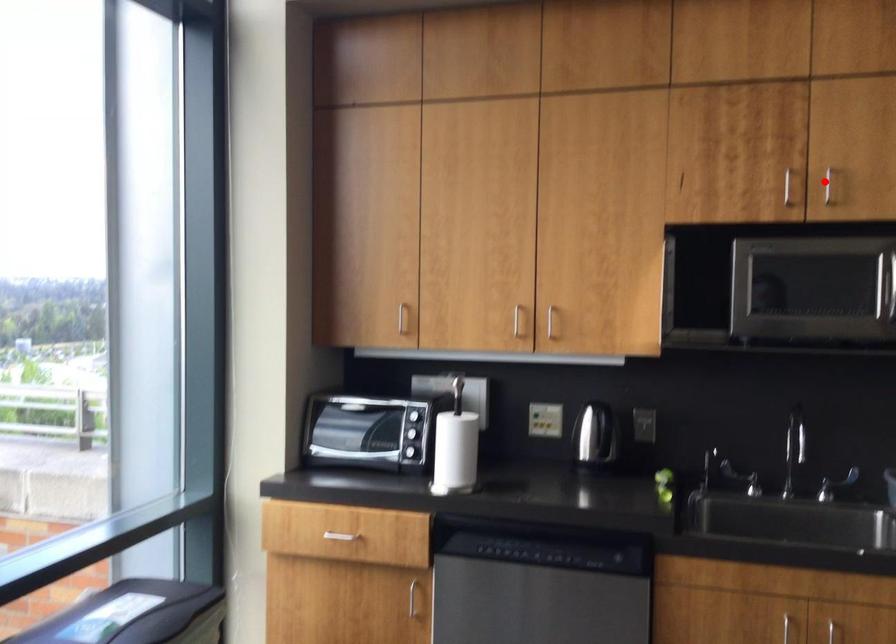
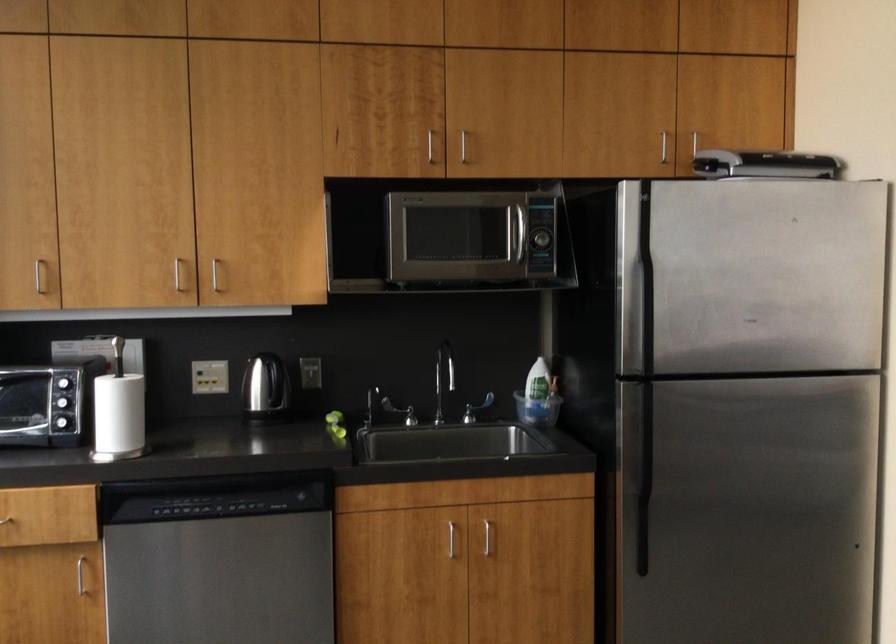
Where in the second image is the point corresponding to the highlighted location from the first image?

(462, 146)